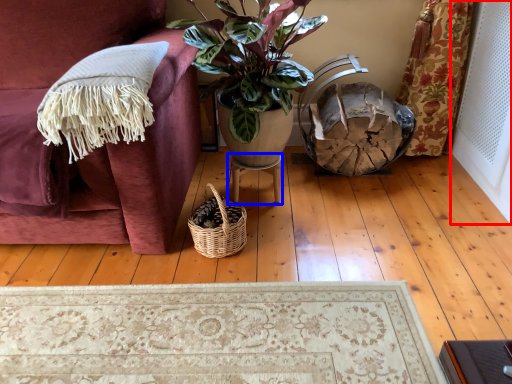
Question: Which point is closer to the camera, screen door (highlighted by a red box) or table (highlighted by a blue box)?

Choices:
 (A) screen door
 (B) table

Answer: (A)